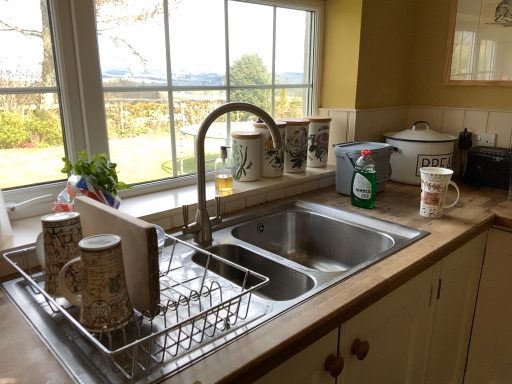
Where is `free spot to the left of black plastic toaster at right, the 2th appliance when ordered from back to front`? free spot to the left of black plastic toaster at right, the 2th appliance when ordered from back to front is located at coordinates (468, 183).